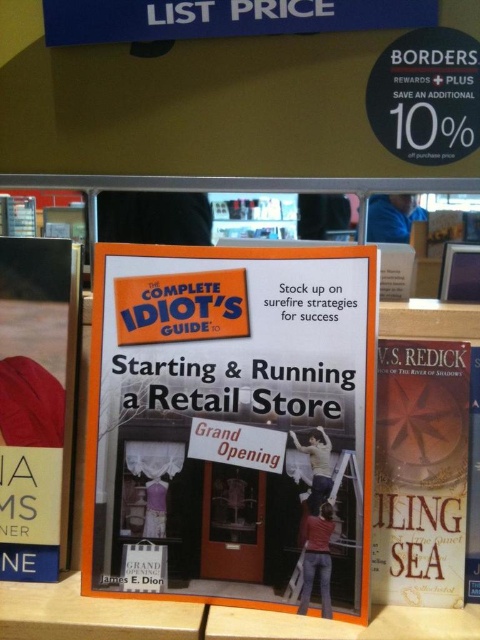
You are a customer in the bookstore looking for the largest hardcover book. You see the hardcover book at left and the hardcover book at center. Which one should you choose?

The hardcover book at left is larger in size than the hardcover book at center, so you should choose the hardcover book at left.

You are a customer looking to buy a book for your new retail business. You see the hardcover book at left and the hardcover book at right on the shelf. Which one is bigger?

The hardcover book at left is larger in size than the hardcover book at right.

You are organizing a display in a bookstore and need to stack books vertically. You have two hardcover books available, the hardcover book at left and the hardcover book at right. Which book should you choose if you want the tallest stack possible?

The hardcover book at left has a greater height compared to the hardcover book at right, so you should choose the hardcover book at left to create the tallest stack possible.